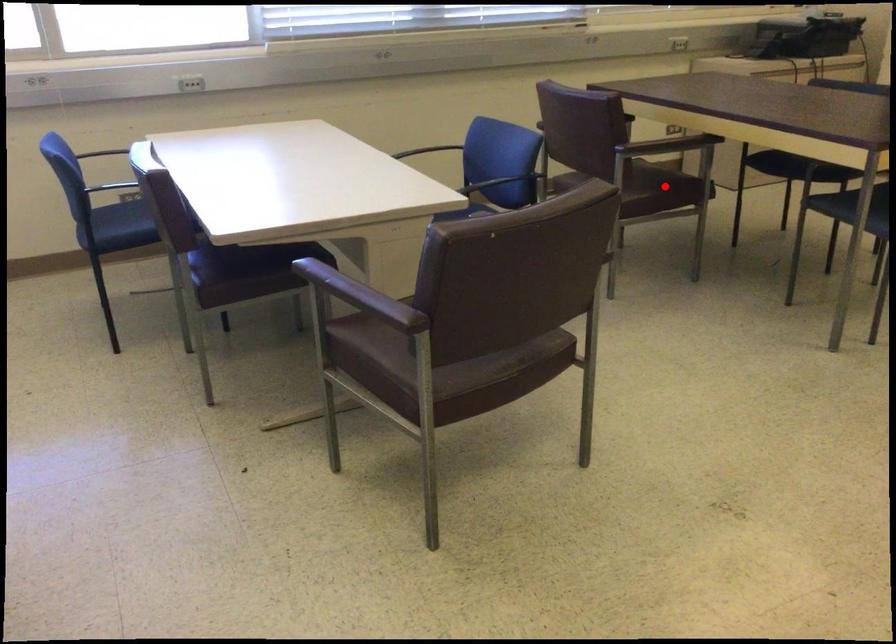
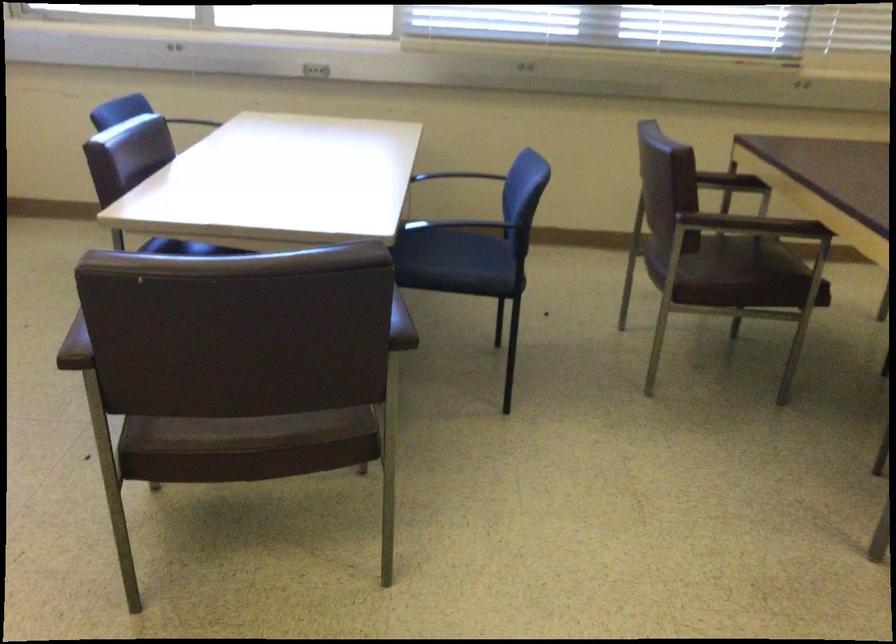
Question: I am providing you with two images of the same scene from different viewpoints. Given a red point in image1, look at the same physical point in image2. Is it:

Choices:
 (A) Closer to the viewpoint
 (B) Farther from the viewpoint

Answer: (A)